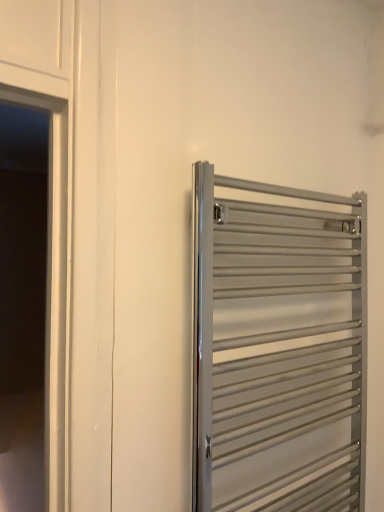
The width and height of the screenshot is (384, 512). Describe the element at coordinates (278, 349) in the screenshot. I see `polished silver towel rack at right` at that location.

Identify the location of polished silver towel rack at right. (278, 349).

Find the location of a particular element. polished silver towel rack at right is located at coordinates (278, 349).